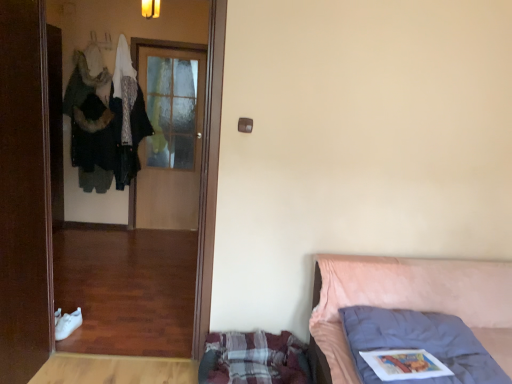
Question: Would you say plaid fabric mattress at lower center is part of wooden screen door at left's contents?

Choices:
 (A) yes
 (B) no

Answer: (B)

Question: Can we say wooden screen door at left lies outside plaid fabric mattress at lower center?

Choices:
 (A) no
 (B) yes

Answer: (B)

Question: From a real-world perspective, is wooden screen door at left physically below plaid fabric mattress at lower center?

Choices:
 (A) yes
 (B) no

Answer: (B)

Question: Does wooden screen door at left have a greater height compared to plaid fabric mattress at lower center?

Choices:
 (A) no
 (B) yes

Answer: (B)

Question: Considering the relative positions of wooden screen door at left and plaid fabric mattress at lower center in the image provided, is wooden screen door at left to the left of plaid fabric mattress at lower center from the viewer's perspective?

Choices:
 (A) yes
 (B) no

Answer: (A)

Question: Considering their positions, is plaid fabric mattress at lower center located in front of or behind brown wooden door at left, marked as the 2th door in a back-to-front arrangement?

Choices:
 (A) behind
 (B) front

Answer: (A)

Question: In terms of height, does plaid fabric mattress at lower center look taller or shorter compared to brown wooden door at left, the first door from the front?

Choices:
 (A) short
 (B) tall

Answer: (A)

Question: From the image's perspective, relative to brown wooden door at left, the first door from the front, is plaid fabric mattress at lower center above or below?

Choices:
 (A) above
 (B) below

Answer: (B)

Question: From a real-world perspective, is plaid fabric mattress at lower center above or below brown wooden door at left, marked as the 2th door in a back-to-front arrangement?

Choices:
 (A) above
 (B) below

Answer: (B)

Question: Is pink fabric bed at right wider or thinner than brown wooden door at left, the first door from the front?

Choices:
 (A) wide
 (B) thin

Answer: (A)

Question: From a real-world perspective, relative to brown wooden door at left, the first door from the front, is pink fabric bed at right vertically above or below?

Choices:
 (A) above
 (B) below

Answer: (B)

Question: From the image's perspective, is pink fabric bed at right above or below brown wooden door at left, marked as the 2th door in a back-to-front arrangement?

Choices:
 (A) above
 (B) below

Answer: (B)

Question: Relative to brown wooden door at left, the first door from the front, is pink fabric bed at right in front or behind?

Choices:
 (A) behind
 (B) front

Answer: (B)

Question: Is brown wooden door at left, the first door from the front, wider or thinner than wooden door at center, which is counted as the second door, starting from the front?

Choices:
 (A) wide
 (B) thin

Answer: (A)

Question: In the image, is brown wooden door at left, marked as the 2th door in a back-to-front arrangement, positioned in front of or behind wooden door at center, marked as the 1th door in a back-to-front arrangement?

Choices:
 (A) behind
 (B) front

Answer: (B)